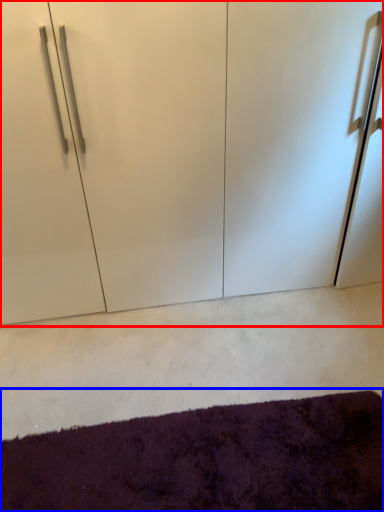
Question: Which object appears farthest to the camera in this image, cupboard (highlighted by a red box) or mat (highlighted by a blue box)?

Choices:
 (A) cupboard
 (B) mat

Answer: (A)